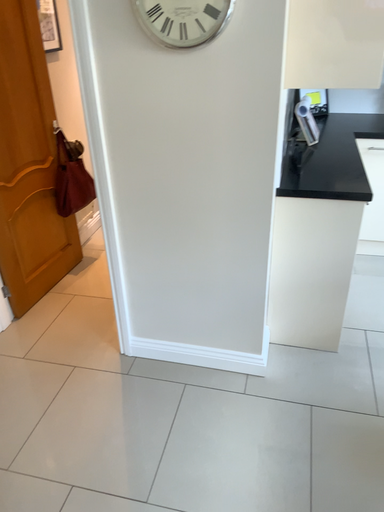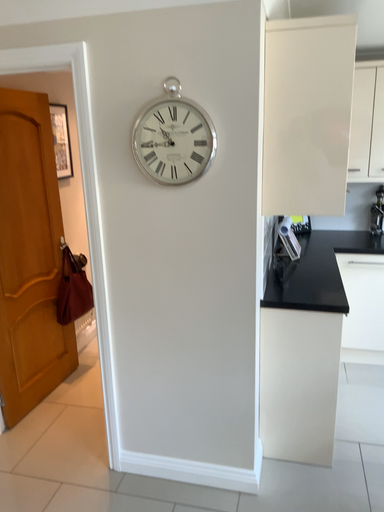
Question: Which way did the camera rotate in the video?

Choices:
 (A) rotated downward
 (B) rotated upward

Answer: (B)